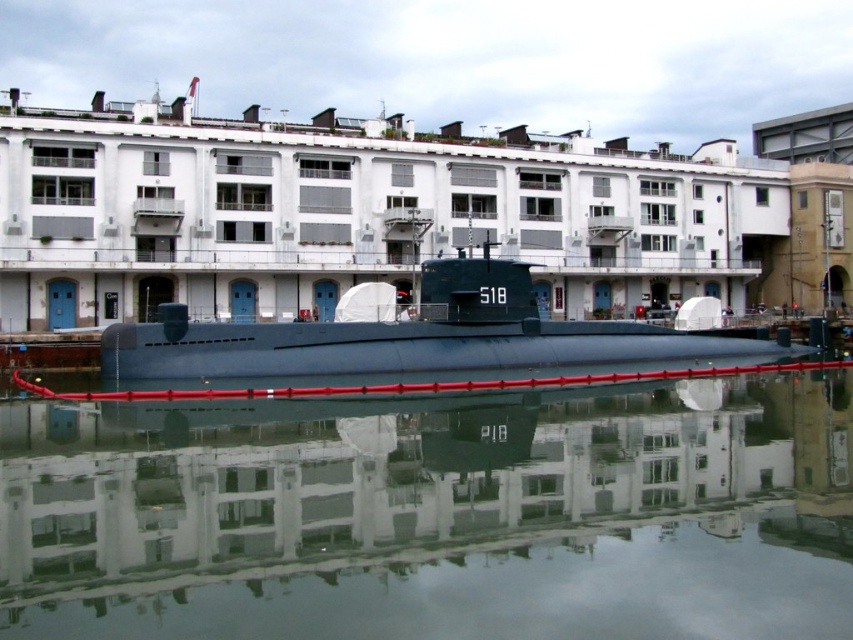
Question: Which object is farther from the camera taking this photo?

Choices:
 (A) transparent glass water at center
 (B) matte black submarine at center

Answer: (B)

Question: Does transparent glass water at center appear on the left side of matte black submarine at center?

Choices:
 (A) yes
 (B) no

Answer: (B)

Question: Is transparent glass water at center to the left of matte black submarine at center from the viewer's perspective?

Choices:
 (A) no
 (B) yes

Answer: (A)

Question: Is transparent glass water at center to the right of matte black submarine at center from the viewer's perspective?

Choices:
 (A) no
 (B) yes

Answer: (B)

Question: Which point appears farthest from the camera in this image?

Choices:
 (A) (80, 524)
 (B) (328, 340)

Answer: (B)

Question: Among these objects, which one is nearest to the camera?

Choices:
 (A) matte black submarine at center
 (B) transparent glass water at center

Answer: (B)